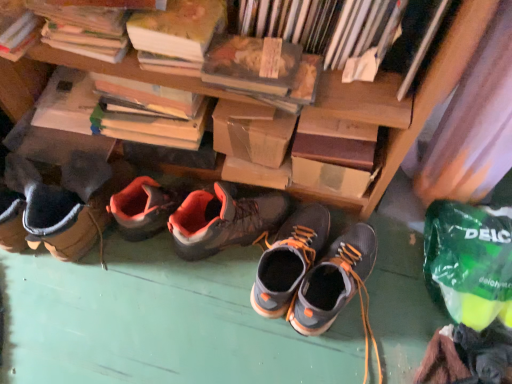
Locate an element on the screen. vacant area situated to the left side of matte gray and orange hiking boots at center, acting as the 1th footwear starting from the right is located at coordinates (234, 313).